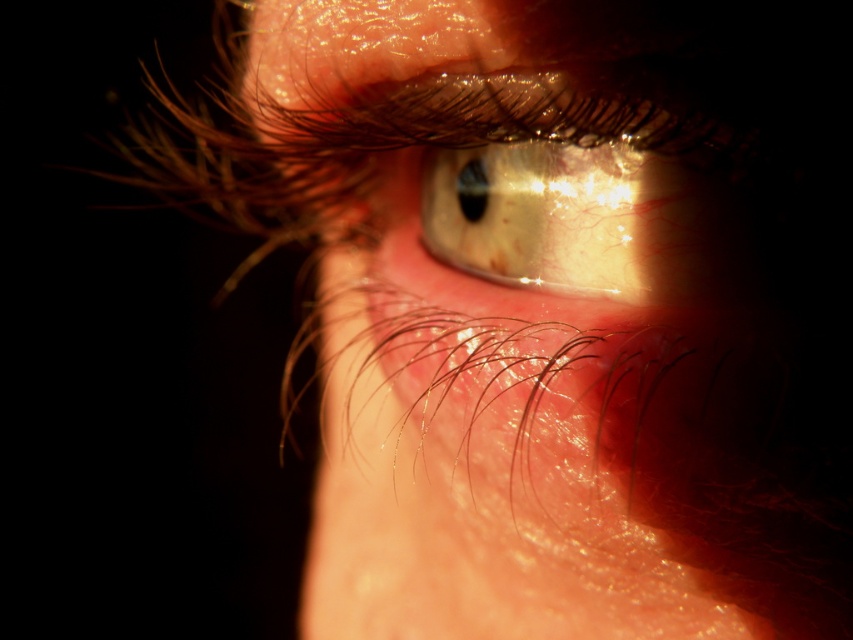
Based on the photo, which is below, smooth skin eye at center or shiny gold eye at center?

smooth skin eye at center is below.

Can you confirm if smooth skin eye at center is shorter than shiny gold eye at center?

No, smooth skin eye at center is not shorter than shiny gold eye at center.

What do you see at coordinates (563, 420) in the screenshot?
I see `smooth skin eye at center` at bounding box center [563, 420].

Identify the location of smooth skin eye at center. (563, 420).